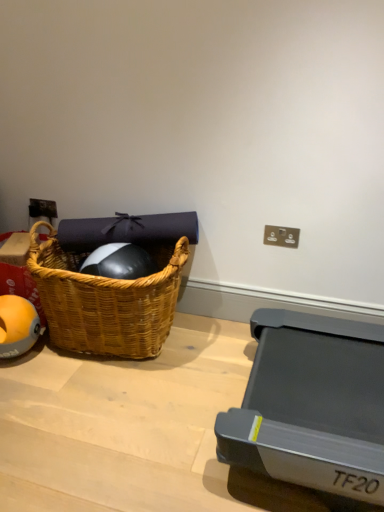
Image resolution: width=384 pixels, height=512 pixels. I want to click on vacant space in front of woven wood picnic basket at left, so click(x=102, y=414).